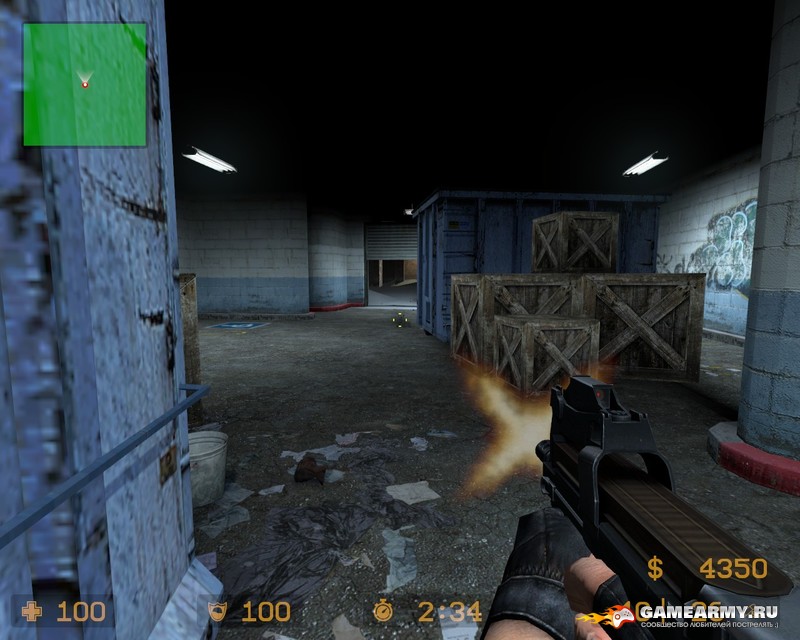
This screenshot has height=640, width=800. I want to click on money box, so click(710, 564).